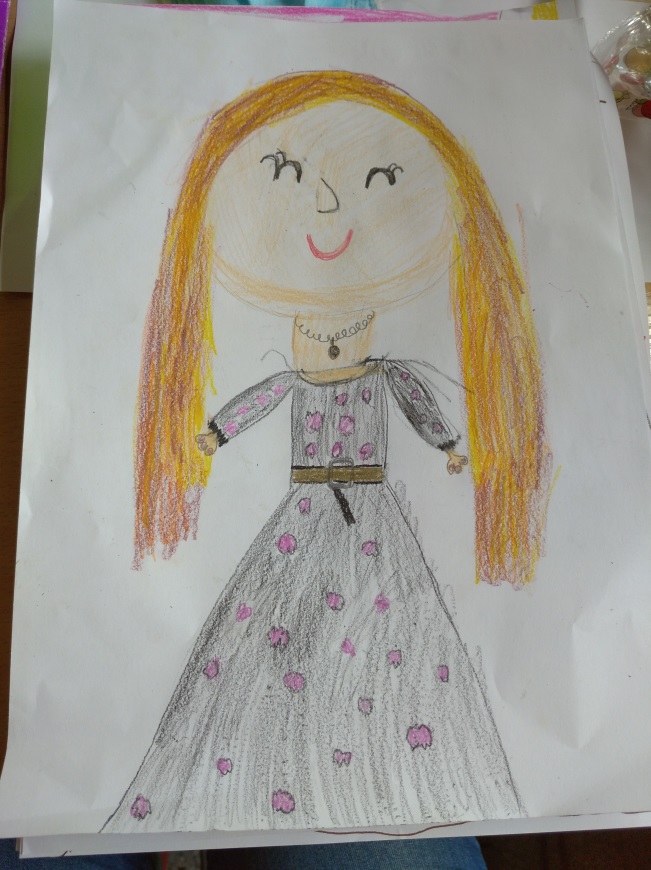
Where is `pendant`? Image resolution: width=651 pixels, height=870 pixels. pendant is located at coordinates (335, 351).